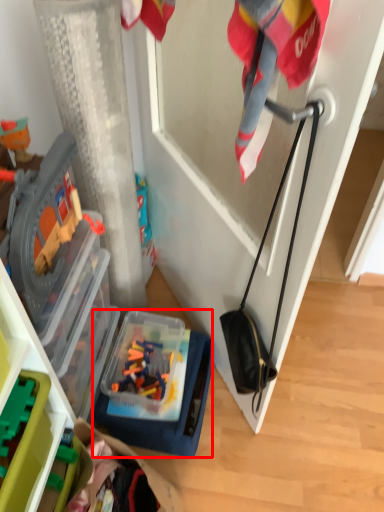
Question: From the image's perspective, considering the relative positions of box (annotated by the red box) and toy in the image provided, where is box (annotated by the red box) located with respect to the staircase?

Choices:
 (A) below
 (B) above

Answer: (A)